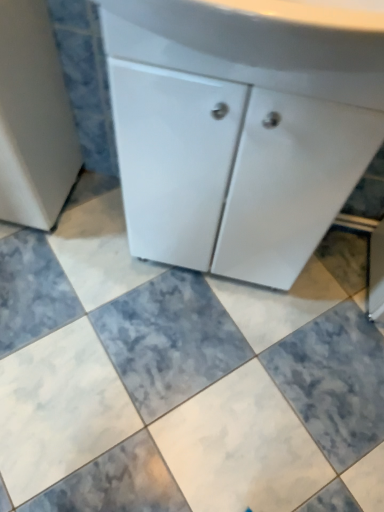
Find the location of a particular element. The width and height of the screenshot is (384, 512). vacant space situated above marble tile at center (from a real-world perspective) is located at coordinates (180, 358).